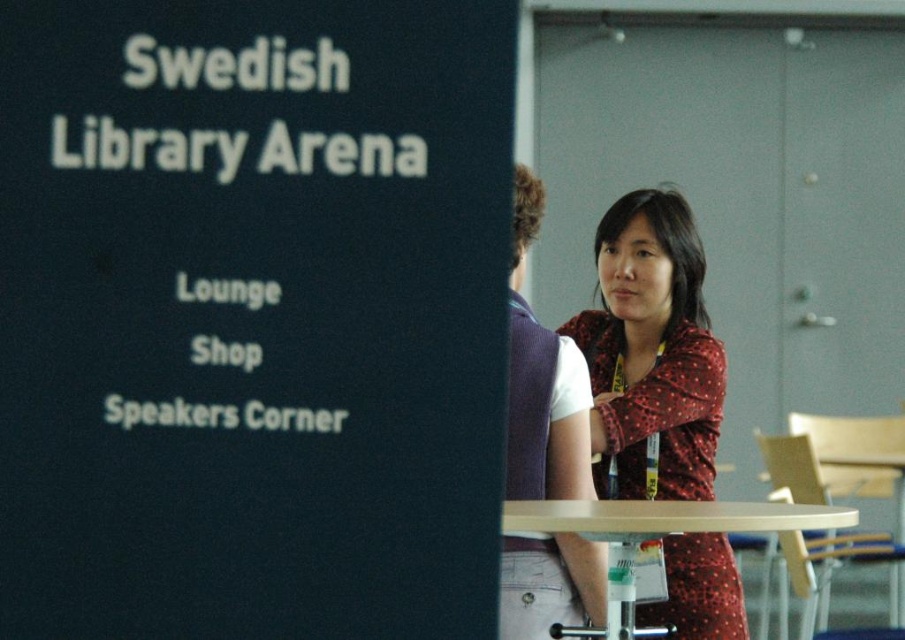
Question: Which point is closer to the camera taking this photo?

Choices:
 (A) (629, 598)
 (B) (91, 496)
 (C) (553, 499)
 (D) (613, 465)

Answer: (B)

Question: Does matte red dress at center lie in front of light wood/wooden table at center?

Choices:
 (A) yes
 (B) no

Answer: (B)

Question: Estimate the real-world distances between objects in this image. Which object is closer to the light wood/wooden table at center?

Choices:
 (A) black matte signboard at upper left
 (B) polka dot fabric shirt at center

Answer: (B)

Question: Which of these objects is positioned closest to the polka dot fabric shirt at center?

Choices:
 (A) matte red dress at center
 (B) black matte signboard at upper left
 (C) light wood/wooden table at center

Answer: (A)

Question: Can you confirm if black matte signboard at upper left is bigger than matte red dress at center?

Choices:
 (A) no
 (B) yes

Answer: (A)

Question: Is polka dot fabric shirt at center positioned before matte red dress at center?

Choices:
 (A) no
 (B) yes

Answer: (A)